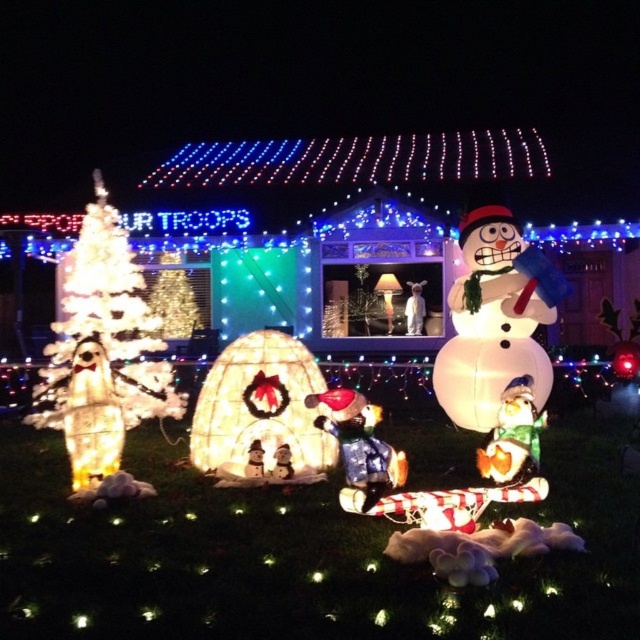
Question: Which is farther from the inflatable white snowman at right?

Choices:
 (A) shiny blue snowman at center
 (B) shiny metallic snowman at center

Answer: (A)

Question: Is inflatable white snowman at right below shiny metallic snowman at center?

Choices:
 (A) no
 (B) yes

Answer: (A)

Question: Is the position of inflatable white snowman at right more distant than that of shiny blue snowman at center?

Choices:
 (A) no
 (B) yes

Answer: (B)

Question: Which object is closer to the camera taking this photo?

Choices:
 (A) shiny metallic snowman at center
 (B) inflatable white snowman at right
 (C) shiny blue snowman at center

Answer: (C)

Question: Is inflatable white snowman at right wider than shiny blue snowman at center?

Choices:
 (A) yes
 (B) no

Answer: (A)

Question: Considering the real-world distances, which object is closest to the shiny metallic snowman at center?

Choices:
 (A) inflatable white snowman at right
 (B) shiny blue snowman at center

Answer: (B)